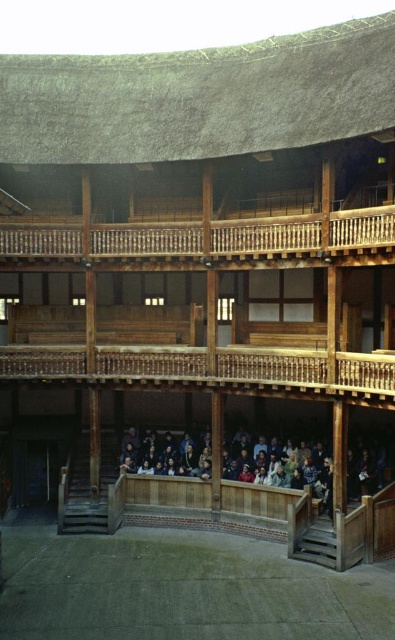
Question: Based on their relative distances, which object is farther from the wooden polished balcony at upper center?

Choices:
 (A) smooth concrete stage at center
 (B) wooden bench at center

Answer: (A)

Question: Can you confirm if wooden polished balcony at upper center is positioned below wooden balustrade at center?

Choices:
 (A) yes
 (B) no

Answer: (B)

Question: Can you confirm if smooth concrete stage at center is thinner than wooden bench at center?

Choices:
 (A) no
 (B) yes

Answer: (A)

Question: Can you confirm if smooth concrete stage at center is positioned below wooden polished balcony at upper center?

Choices:
 (A) yes
 (B) no

Answer: (A)

Question: Which point is closer to the camera?

Choices:
 (A) wooden bench at center
 (B) wooden balustrade at center
 (C) smooth concrete stage at center

Answer: (C)

Question: Which is farther from the wooden polished balcony at upper center?

Choices:
 (A) smooth concrete stage at center
 (B) wooden balustrade at center

Answer: (A)